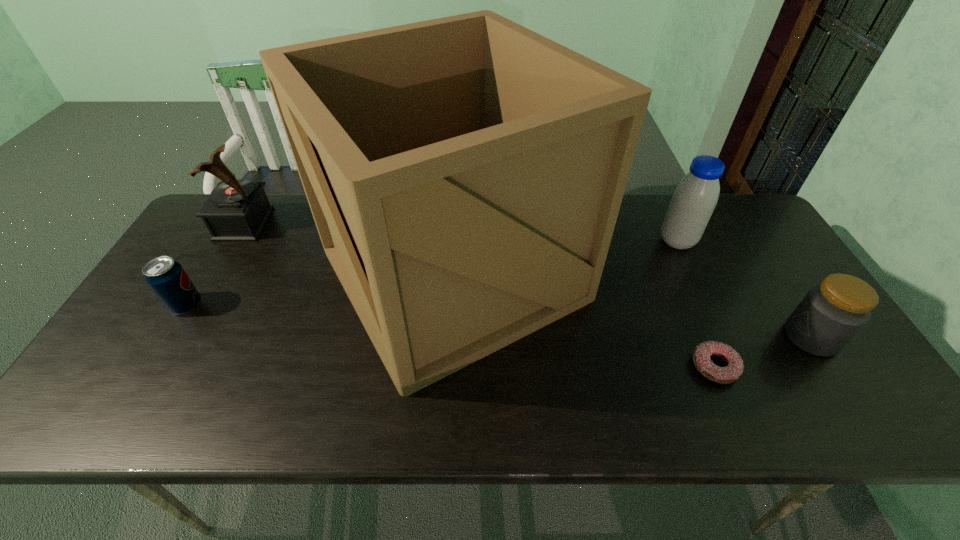
Identify the location of the tallest object. The width and height of the screenshot is (960, 540). (465, 174).

The width and height of the screenshot is (960, 540). Identify the location of box. (465, 174).

Image resolution: width=960 pixels, height=540 pixels. Find the location of `phonograph_record`. phonograph_record is located at coordinates (237, 210).

Locate an element on the screen. The image size is (960, 540). soya milk is located at coordinates (695, 197).

What are the coordinates of `the third shortest object` in the screenshot? It's located at (831, 314).

Identify the location of jar. (831, 314).

Where is `the second shortest object`? The image size is (960, 540). the second shortest object is located at coordinates (167, 279).

You are a GUI agent. You are given a task and a screenshot of the screen. Output one action in this format:
    pyautogui.click(x=<x>, y=<y>)
    Task: Click on the doughnut
    
    Given the screenshot: What is the action you would take?
    pyautogui.click(x=734, y=368)

Where is `free space located 0.380m on the left of the third object from left to right`? free space located 0.380m on the left of the third object from left to right is located at coordinates (182, 274).

Find the location of a particular element. The image size is (960, 540). blank area located at the horn opening of the phonograph_record is located at coordinates (358, 224).